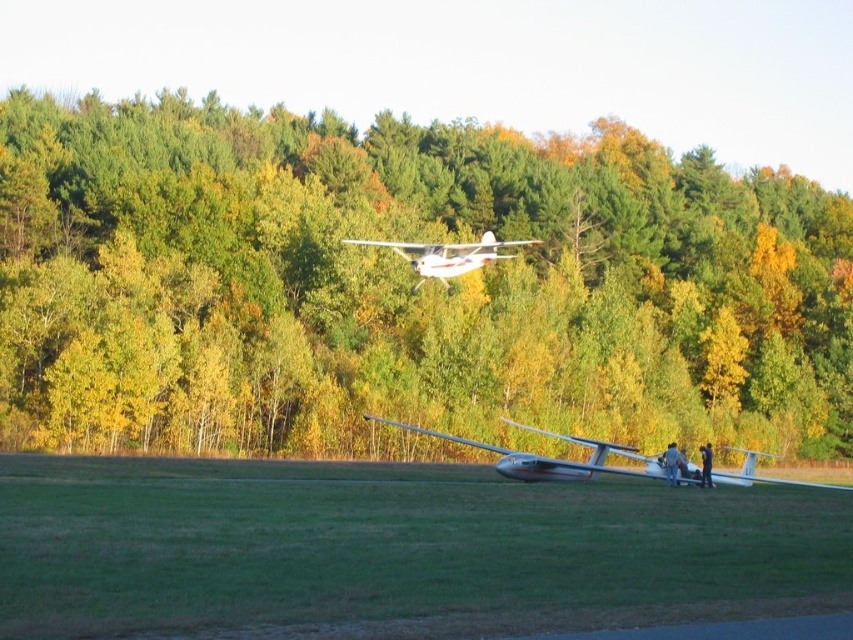
Does green matte trees at upper center have a greater height compared to white matte airplane at upper center?

Yes, green matte trees at upper center is taller than white matte airplane at upper center.

Is green matte trees at upper center further to the viewer compared to white matte airplane at upper center?

Yes.

In order to click on green matte trees at upper center in this screenshot , I will do `click(403, 285)`.

Does green grass at lower center have a lesser width compared to silver metallic glider at lower center?

Indeed, green grass at lower center has a lesser width compared to silver metallic glider at lower center.

How far apart are green grass at lower center and silver metallic glider at lower center?

They are 9.00 meters apart.

Which is in front, point (306, 592) or point (648, 467)?

Point (306, 592) is in front.

You are a GUI agent. You are given a task and a screenshot of the screen. Output one action in this format:
    pyautogui.click(x=<x>, y=<y>)
    Task: Click on the green grass at lower center
    The height and width of the screenshot is (640, 853).
    Given the screenshot: What is the action you would take?
    pyautogui.click(x=393, y=550)

Can you confirm if silver metallic glider at lower center is shorter than white matte airplane at upper center?

Yes.

Is silver metallic glider at lower center smaller than white matte airplane at upper center?

Indeed, silver metallic glider at lower center has a smaller size compared to white matte airplane at upper center.

Which is in front, point (583, 465) or point (380, 241)?

Point (583, 465) is more forward.

Where is `silver metallic glider at lower center`? Image resolution: width=853 pixels, height=640 pixels. silver metallic glider at lower center is located at coordinates (549, 458).